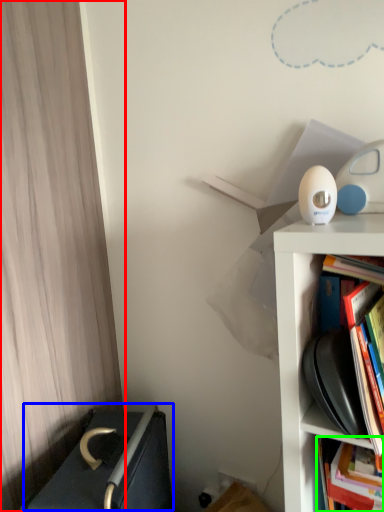
Question: Based on their relative distances, which object is nearer to curtain (highlighted by a red box)? Choose from writing (highlighted by a blue box) and book (highlighted by a green box).

Choices:
 (A) writing
 (B) book

Answer: (A)